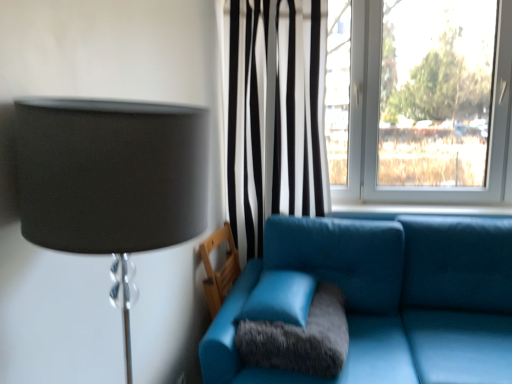
Question: Is black striped curtain at center oriented towards teal leather armchair at lower center?

Choices:
 (A) yes
 (B) no

Answer: (A)

Question: Can you confirm if black striped curtain at center is wider than teal leather armchair at lower center?

Choices:
 (A) yes
 (B) no

Answer: (A)

Question: Is black striped curtain at center taller than teal leather armchair at lower center?

Choices:
 (A) yes
 (B) no

Answer: (A)

Question: From the image's perspective, is black striped curtain at center under teal leather armchair at lower center?

Choices:
 (A) no
 (B) yes

Answer: (A)

Question: Is black striped curtain at center shorter than teal leather armchair at lower center?

Choices:
 (A) no
 (B) yes

Answer: (A)

Question: Is black striped curtain at center further to camera compared to teal leather armchair at lower center?

Choices:
 (A) yes
 (B) no

Answer: (A)

Question: Can you confirm if blue fabric window sill at center is shorter than matte black lampshade at left?

Choices:
 (A) yes
 (B) no

Answer: (A)

Question: Are blue fabric window sill at center and matte black lampshade at left far apart?

Choices:
 (A) no
 (B) yes

Answer: (B)

Question: Is blue fabric window sill at center bigger than matte black lampshade at left?

Choices:
 (A) yes
 (B) no

Answer: (B)

Question: Is matte black lampshade at left surrounded by blue fabric window sill at center?

Choices:
 (A) no
 (B) yes

Answer: (A)

Question: From a real-world perspective, is blue fabric window sill at center positioned under matte black lampshade at left based on gravity?

Choices:
 (A) no
 (B) yes

Answer: (B)

Question: Is blue fabric window sill at center to the left of matte black lampshade at left from the viewer's perspective?

Choices:
 (A) no
 (B) yes

Answer: (A)

Question: Considering the relative sizes of blue fabric window sill at center and black striped curtain at center in the image provided, is blue fabric window sill at center wider than black striped curtain at center?

Choices:
 (A) no
 (B) yes

Answer: (A)